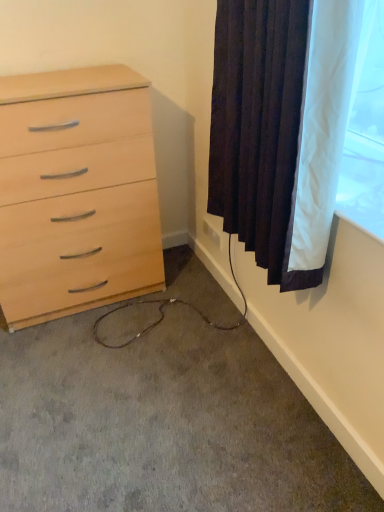
Question: Can you confirm if light wood chest of drawers at left is taller than carpet at lower left?

Choices:
 (A) no
 (B) yes

Answer: (B)

Question: From the image's perspective, is light wood chest of drawers at left located above carpet at lower left?

Choices:
 (A) no
 (B) yes

Answer: (B)

Question: Considering the relative positions of light wood chest of drawers at left and carpet at lower left in the image provided, is light wood chest of drawers at left to the left of carpet at lower left from the viewer's perspective?

Choices:
 (A) no
 (B) yes

Answer: (B)

Question: Can you confirm if light wood chest of drawers at left is bigger than carpet at lower left?

Choices:
 (A) yes
 (B) no

Answer: (A)

Question: Considering the relative sizes of light wood chest of drawers at left and carpet at lower left in the image provided, is light wood chest of drawers at left smaller than carpet at lower left?

Choices:
 (A) yes
 (B) no

Answer: (B)

Question: Based on their positions, is light wood chest of drawers at left located to the left or right of carpet at lower left?

Choices:
 (A) left
 (B) right

Answer: (A)

Question: From the image's perspective, is light wood chest of drawers at left above or below carpet at lower left?

Choices:
 (A) below
 (B) above

Answer: (B)

Question: Considering their positions, is light wood chest of drawers at left located in front of or behind carpet at lower left?

Choices:
 (A) behind
 (B) front

Answer: (A)

Question: Is light wood chest of drawers at left inside the boundaries of carpet at lower left, or outside?

Choices:
 (A) inside
 (B) outside

Answer: (B)

Question: From a real-world perspective, is white plastic outlet at lower right physically located above or below carpet at lower left?

Choices:
 (A) above
 (B) below

Answer: (A)

Question: In the image, is white plastic outlet at lower right on the left side or the right side of carpet at lower left?

Choices:
 (A) right
 (B) left

Answer: (A)

Question: From the image's perspective, is white plastic outlet at lower right located above or below carpet at lower left?

Choices:
 (A) below
 (B) above

Answer: (B)

Question: Considering the positions of white plastic outlet at lower right and carpet at lower left in the image, is white plastic outlet at lower right wider or thinner than carpet at lower left?

Choices:
 (A) wide
 (B) thin

Answer: (B)

Question: From a real-world perspective, relative to white plastic outlet at lower right, is light wood chest of drawers at left vertically above or below?

Choices:
 (A) above
 (B) below

Answer: (A)

Question: Is light wood chest of drawers at left inside or outside of white plastic outlet at lower right?

Choices:
 (A) inside
 (B) outside

Answer: (B)